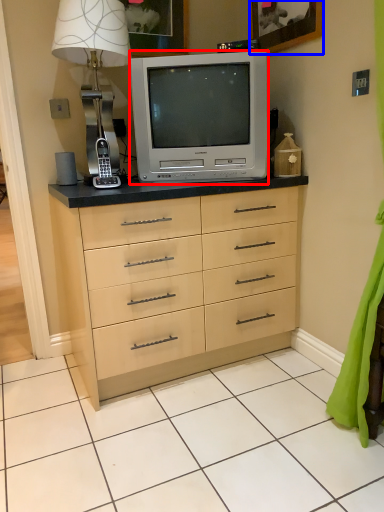
Question: Which point is further to the camera, television (highlighted by a red box) or picture frame (highlighted by a blue box)?

Choices:
 (A) television
 (B) picture frame

Answer: (A)